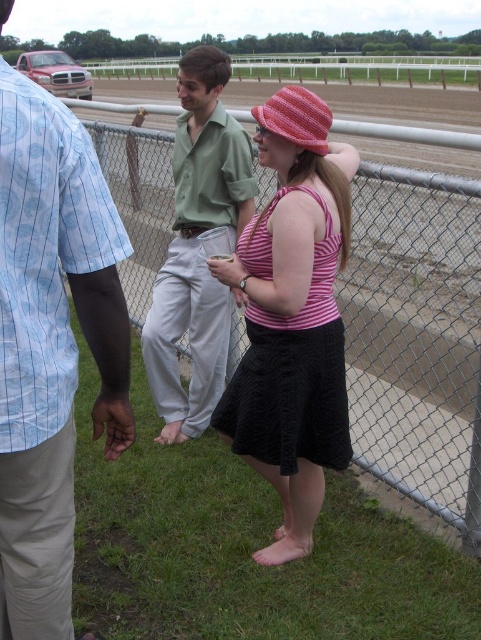
You are organizing a clothing sale and need to arrange items by size. You have two shirts in the foreground of the image, the pink striped tank top at center and the green cotton shirt at center. Which shirt should you place in the small size section?

The pink striped tank top at center should be placed in the small size section since its width is less than the green cotton shirt at center.

You are a photographer trying to capture a group photo of the light blue striped shirt at left and the pink knitted hat at center. If your camera can focus on subjects within a 1.5 meter range, will both subjects be in focus?

The distance between the light blue striped shirt at left and the pink knitted hat at center is 1.28 meters, which is within the 1.5 meter range. Therefore, both subjects will be in focus.